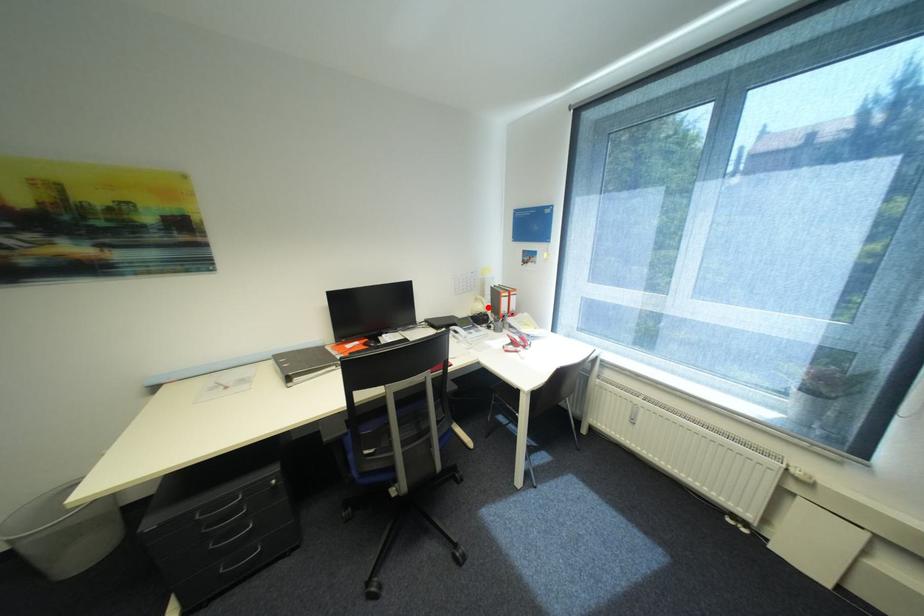
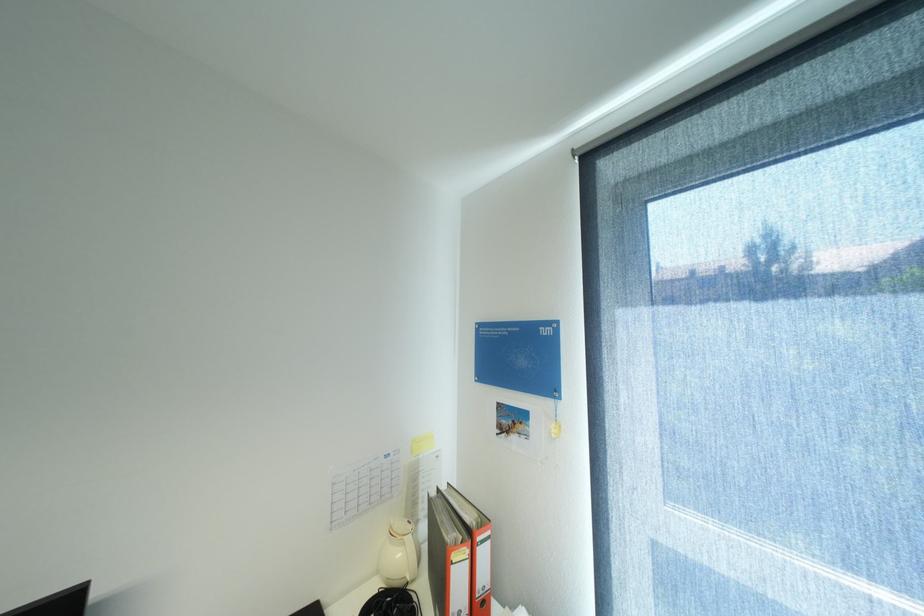
Locate, in the second image, the point that corresponds to the highlighted location in the first image.

(407, 554)